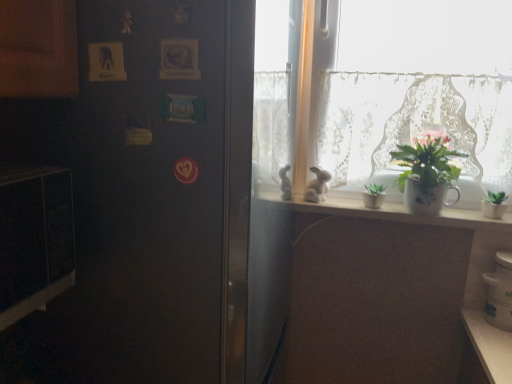
Question: Is white lace curtain at upper right further to camera compared to satin black refrigerator at left?

Choices:
 (A) no
 (B) yes

Answer: (B)

Question: From a real-world perspective, does white lace curtain at upper right sit lower than satin black refrigerator at left?

Choices:
 (A) no
 (B) yes

Answer: (A)

Question: Does white lace curtain at upper right come in front of satin black refrigerator at left?

Choices:
 (A) yes
 (B) no

Answer: (B)

Question: Is white lace curtain at upper right smaller than satin black refrigerator at left?

Choices:
 (A) yes
 (B) no

Answer: (A)

Question: From the image's perspective, is white lace curtain at upper right above satin black refrigerator at left?

Choices:
 (A) no
 (B) yes

Answer: (B)

Question: From the image's perspective, relative to black matte microwave at left, is white wooden shelf at upper center above or below?

Choices:
 (A) above
 (B) below

Answer: (A)

Question: Relative to black matte microwave at left, is white wooden shelf at upper center in front or behind?

Choices:
 (A) behind
 (B) front

Answer: (A)

Question: Is white wooden shelf at upper center situated inside black matte microwave at left or outside?

Choices:
 (A) outside
 (B) inside

Answer: (A)

Question: From a real-world perspective, is white wooden shelf at upper center positioned above or below black matte microwave at left?

Choices:
 (A) above
 (B) below

Answer: (B)

Question: Is point (369, 99) closer or farther from the camera than point (309, 198)?

Choices:
 (A) farther
 (B) closer

Answer: (B)

Question: From the image's perspective, is white lace curtain at upper right located above or below white matte rabbit at window?

Choices:
 (A) above
 (B) below

Answer: (A)

Question: In the image, is white lace curtain at upper right on the left side or the right side of white matte rabbit at window?

Choices:
 (A) right
 (B) left

Answer: (A)

Question: In terms of height, does white lace curtain at upper right look taller or shorter compared to white matte rabbit at window?

Choices:
 (A) short
 (B) tall

Answer: (B)

Question: From a real-world perspective, relative to white glossy jar at lower right, is satin black refrigerator at left vertically above or below?

Choices:
 (A) below
 (B) above

Answer: (B)

Question: Is point (96, 127) closer or farther from the camera than point (492, 294)?

Choices:
 (A) farther
 (B) closer

Answer: (B)